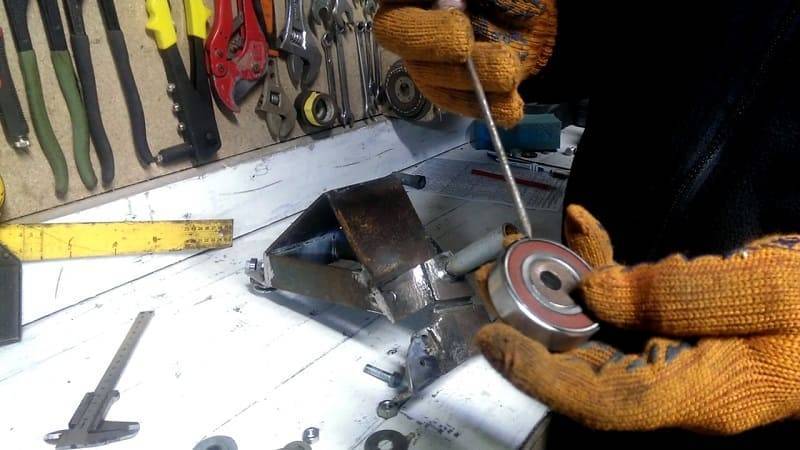
The image size is (800, 450). I want to click on white wood table, so [x=197, y=343].